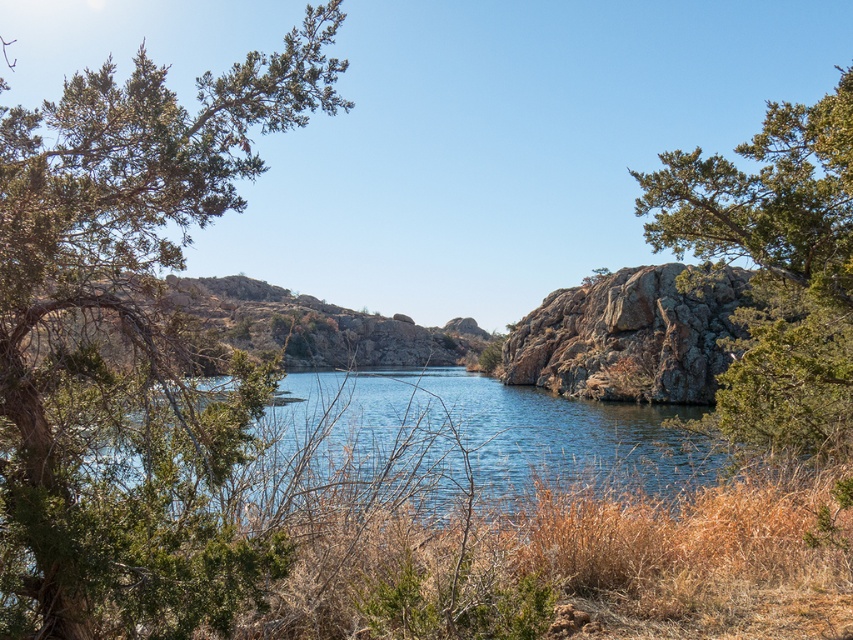
Does green leafy tree at left have a lesser height compared to rusty rock at center?

Indeed, green leafy tree at left has a lesser height compared to rusty rock at center.

Is point (30, 632) farther from camera compared to point (619, 396)?

No, (30, 632) is in front of (619, 396).

Which is behind, point (126, 358) or point (538, 324)?

Positioned behind is point (538, 324).

Find the location of `green leafy tree at left`. green leafy tree at left is located at coordinates (131, 348).

Can you confirm if green textured rock at right is bigger than rusty rock at center?

No.

What do you see at coordinates (775, 269) in the screenshot?
I see `green textured rock at right` at bounding box center [775, 269].

This screenshot has height=640, width=853. In order to click on green textured rock at right in this screenshot , I will do `click(775, 269)`.

Where is `green textured rock at right`? The width and height of the screenshot is (853, 640). green textured rock at right is located at coordinates (775, 269).

Is point (207, 192) closer to viewer compared to point (780, 444)?

That is True.

Who is more distant from viewer, (222,477) or (677,209)?

The point (677,209) is more distant.

Is point (146, 326) closer to camera compared to point (851, 410)?

Yes, point (146, 326) is in front of point (851, 410).

Where is `green leafy tree at left`? This screenshot has width=853, height=640. green leafy tree at left is located at coordinates (131, 348).